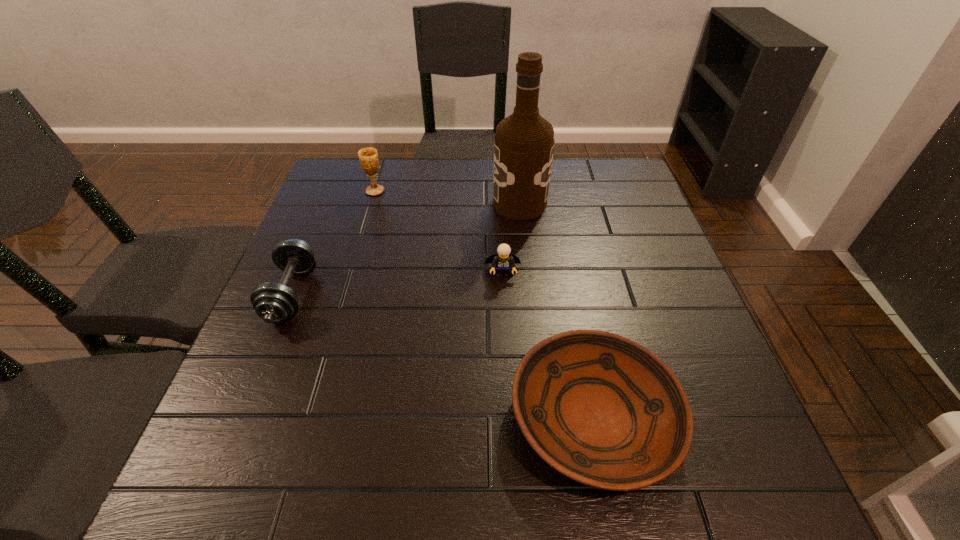
Locate an element on the screen. The image size is (960, 540). unoccupied area between the nearest object and the chalice is located at coordinates (485, 304).

I want to click on free space between the plate and the tallest object, so pyautogui.click(x=557, y=310).

Locate an element on the screen. The image size is (960, 540). empty space that is in between the chalice and the alcohol is located at coordinates (447, 197).

I want to click on vacant space in between the tallest object and the dumbbell, so click(406, 249).

Find the location of a particular element. This screenshot has height=540, width=960. vacant region between the alcohol and the shortest object is located at coordinates (557, 310).

This screenshot has height=540, width=960. I want to click on free spot between the nearest object and the tallest object, so click(557, 310).

Where is `free space between the leftmost object and the Lego`? The height and width of the screenshot is (540, 960). free space between the leftmost object and the Lego is located at coordinates (397, 284).

I want to click on blank region between the Lego and the dumbbell, so click(397, 284).

Point out which object is positioned as the fourth nearest to the second object from left to right. Please provide its 2D coordinates. Your answer should be formatted as a tuple, i.e. [(x, y)], where the tuple contains the x and y coordinates of a point satisfying the conditions above.

[(604, 411)]

Point out which object is positioned as the third nearest to the nearest object. Please provide its 2D coordinates. Your answer should be formatted as a tuple, i.e. [(x, y)], where the tuple contains the x and y coordinates of a point satisfying the conditions above.

[(273, 302)]